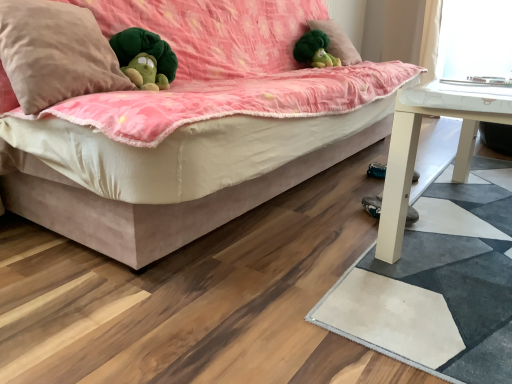
Where is `vacant space that is to the left of black suede shoe at lower right`? This screenshot has width=512, height=384. vacant space that is to the left of black suede shoe at lower right is located at coordinates (338, 213).